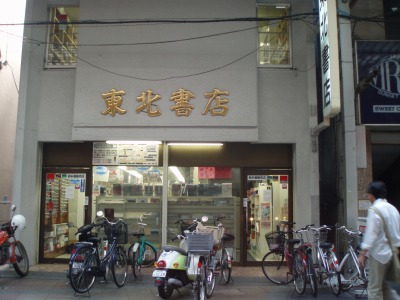
This screenshot has height=300, width=400. In order to click on basket in this screenshot , I will do `click(275, 245)`.